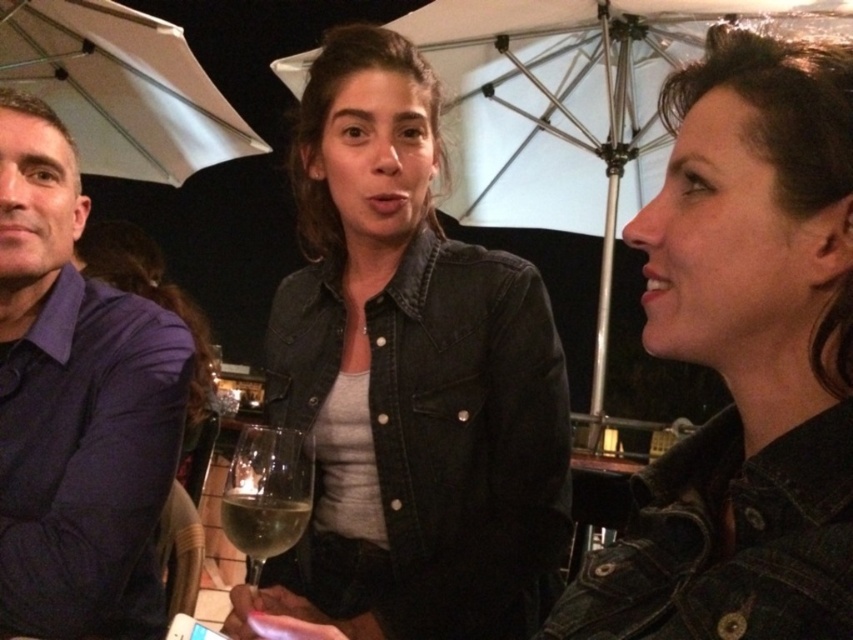
You are at an outdoor event and want to avoid getting wet in case it rains. You see a white matte umbrella at upper left and a clear glass wine at center. Which object is above the other?

The white matte umbrella at upper left is positioned over the clear glass wine at center.

From the picture: You are a waiter at an outdoor event holding a tray of wine glasses. You need to place a new wine glass between the denim jacket at upper right and the clear glass wine glass at center. Can you fit it there?

The distance between the denim jacket at upper right and the clear glass wine glass at center is 14.74 inches. Since a standard wine glass is about 3 to 4 inches wide, there is enough space to place another wine glass between them.

Looking at this image, you are at an outdoor event and need to place a 15 cm wide book on a table between the denim jacket at upper right and the clear glass wine glass at center. Can the book fit between them?

The denim jacket at upper right might be wider than the clear glass wine glass at center, so the space between them may not be sufficient for a 15 cm wide book. Check the actual distance before placing it.